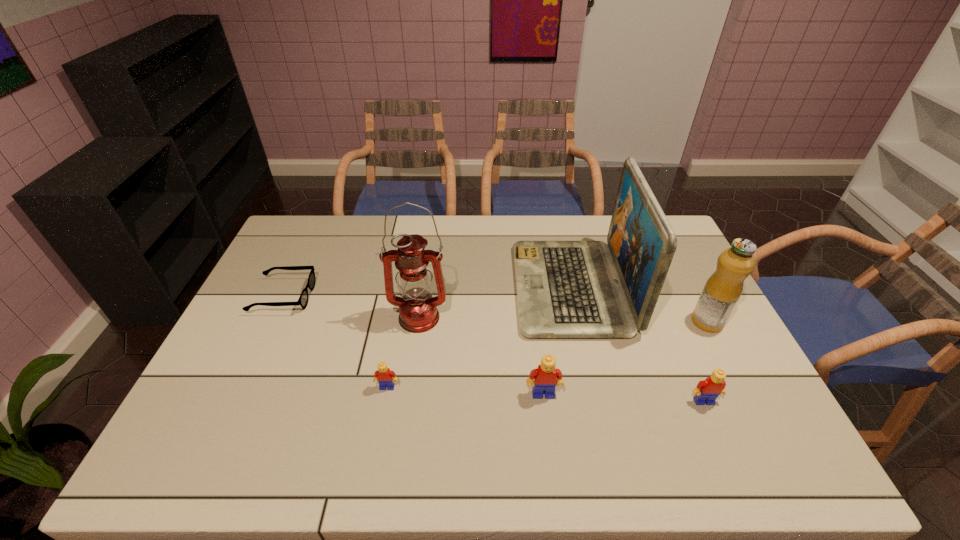
You are a GUI agent. You are given a task and a screenshot of the screen. Output one action in this format:
    pyautogui.click(x=<x>, y=<y>)
    Task: Click on the leftmost Lego
    
    Given the screenshot: What is the action you would take?
    pyautogui.click(x=383, y=375)

In order to click on the shortest Lego in this screenshot , I will do `click(383, 375)`.

This screenshot has height=540, width=960. Identify the location of the tallest Lego. 546,377.

Identify the location of the second Lego from left to right. (546, 377).

I want to click on the fifth tallest object, so click(x=707, y=390).

This screenshot has width=960, height=540. In order to click on the second tallest Lego in this screenshot , I will do (x=707, y=390).

At what (x,y) coordinates should I click in order to perform the action: click on laptop computer. Please return your answer as a coordinate pair (x, y). Looking at the image, I should click on (565, 289).

Where is `oil lamp`? oil lamp is located at coordinates (418, 313).

I want to click on spectacles, so click(303, 299).

I want to click on the shortest object, so click(x=303, y=299).